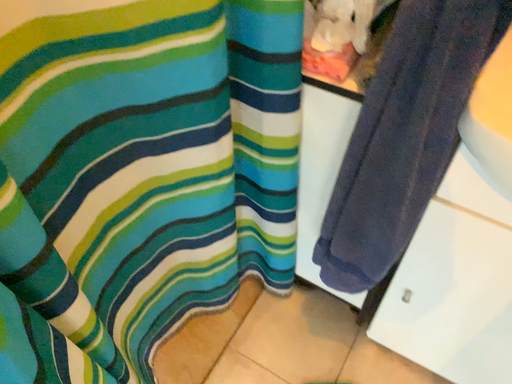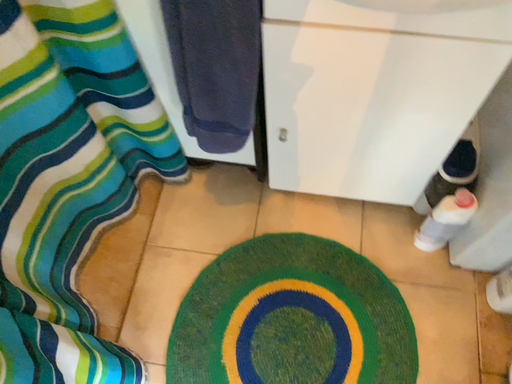
Question: How did the camera likely rotate when shooting the video?

Choices:
 (A) rotated downward
 (B) rotated upward

Answer: (A)